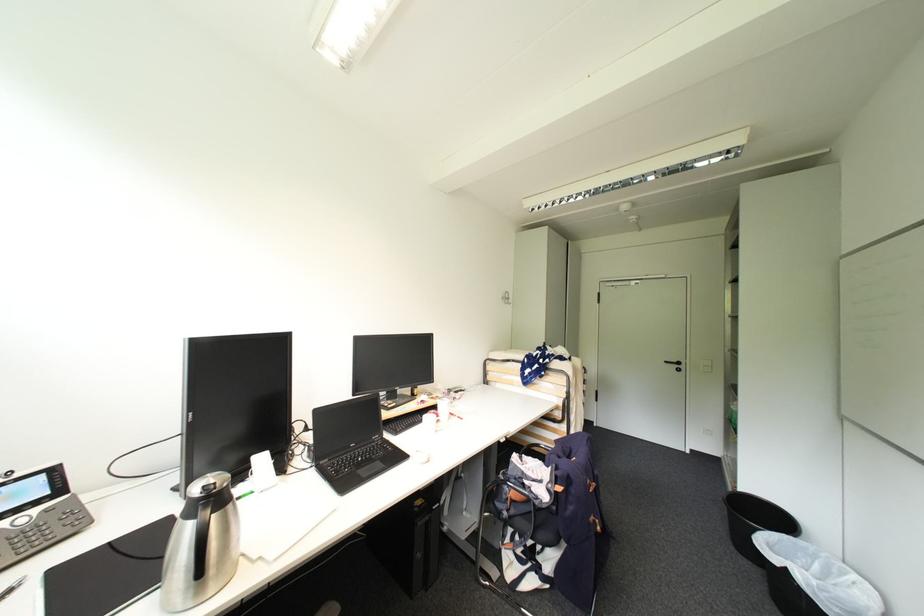
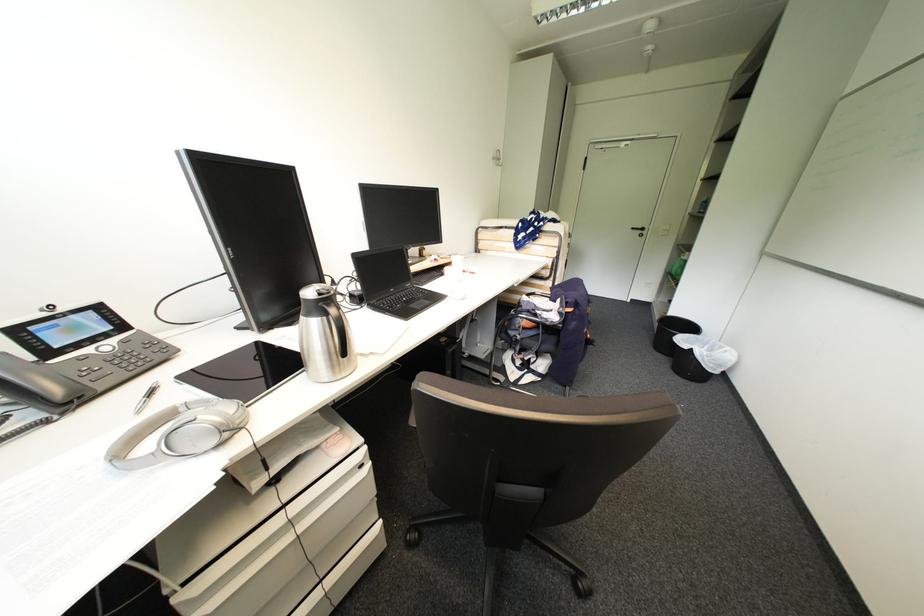
The point at [220,477] is marked in the first image. Where is the corresponding point in the second image?

(324, 286)